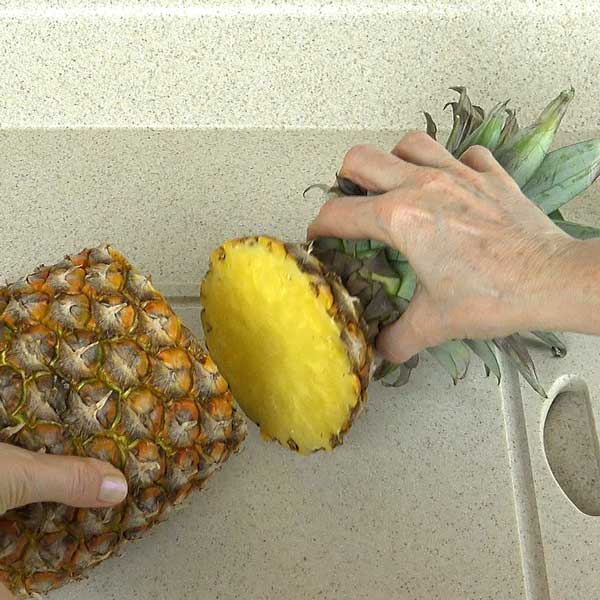
Where is `terrazzo countertop`? terrazzo countertop is located at coordinates (468, 420).